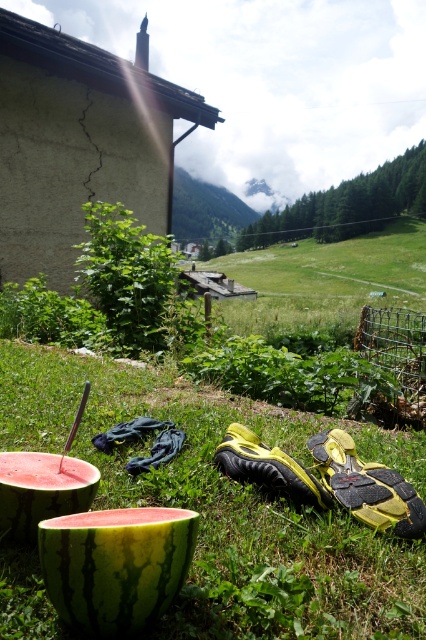
Question: Estimate the real-world distances between objects in this image. Which object is farther from the ripe red watermelon at lower left?

Choices:
 (A) green grass at center
 (B) green rind watermelon at lower center

Answer: (A)

Question: Does green rind watermelon at lower center lie in front of ripe red watermelon at lower left?

Choices:
 (A) no
 (B) yes

Answer: (B)

Question: Considering the relative positions of green grass at center and ripe red watermelon at lower left in the image provided, where is green grass at center located with respect to ripe red watermelon at lower left?

Choices:
 (A) left
 (B) right

Answer: (B)

Question: In this image, where is green rind watermelon at lower center located relative to ripe red watermelon at lower left?

Choices:
 (A) below
 (B) above

Answer: (A)

Question: Which point is closer to the camera?

Choices:
 (A) ripe red watermelon at lower left
 (B) green grass at center

Answer: (B)

Question: Which point is farther to the camera?

Choices:
 (A) green grass at center
 (B) green rind watermelon at lower center

Answer: (A)